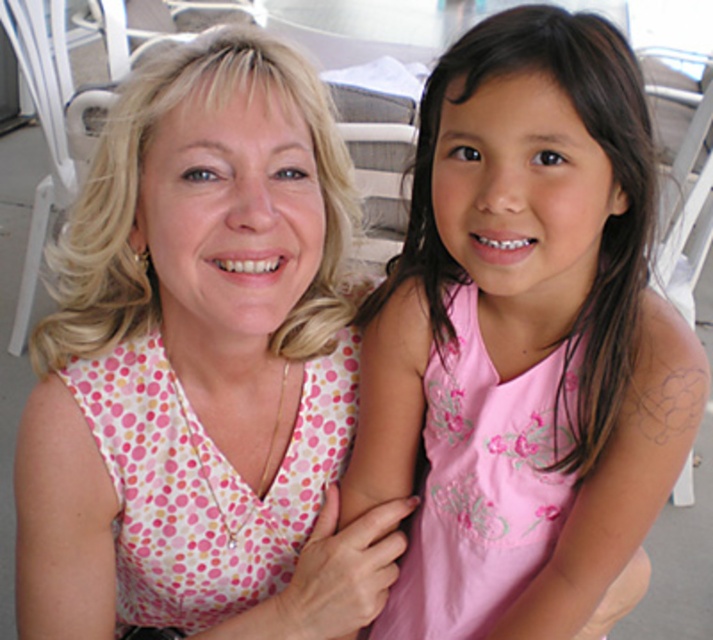
Question: Which point appears farthest from the camera in this image?

Choices:
 (A) (555, 141)
 (B) (501, 442)
 (C) (174, 141)

Answer: (B)

Question: Which object is the farthest from the pink dotted blouse at center?

Choices:
 (A) pink embroidered dress at center
 (B) pink floral dress at center

Answer: (A)

Question: Is pink dotted blouse at center to the right of pink embroidered dress at center from the viewer's perspective?

Choices:
 (A) yes
 (B) no

Answer: (B)

Question: Which object is farther from the camera taking this photo?

Choices:
 (A) pink floral dress at center
 (B) pink embroidered dress at center

Answer: (B)

Question: Is pink dotted blouse at center to the left of pink embroidered dress at center from the viewer's perspective?

Choices:
 (A) no
 (B) yes

Answer: (B)

Question: Does pink floral dress at center appear over pink embroidered dress at center?

Choices:
 (A) no
 (B) yes

Answer: (B)